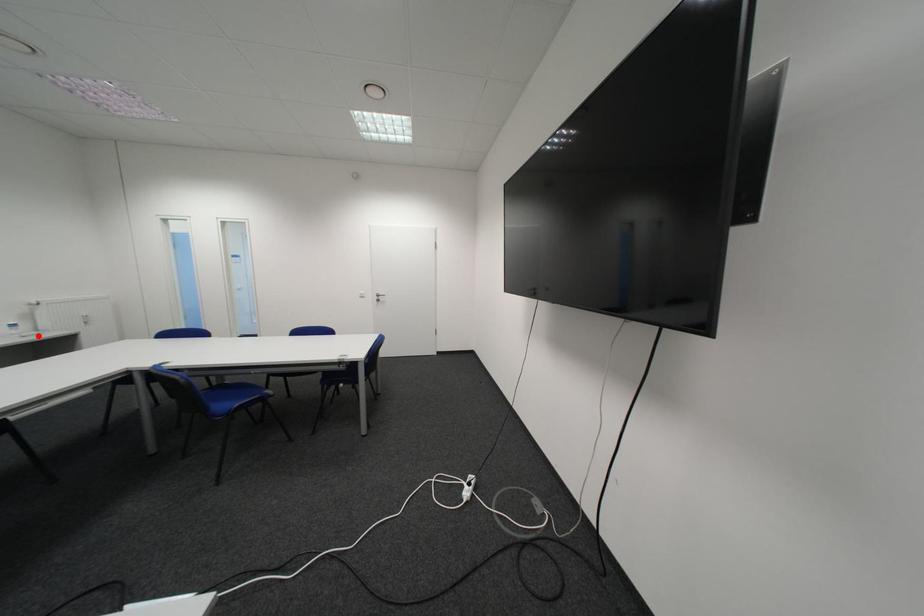
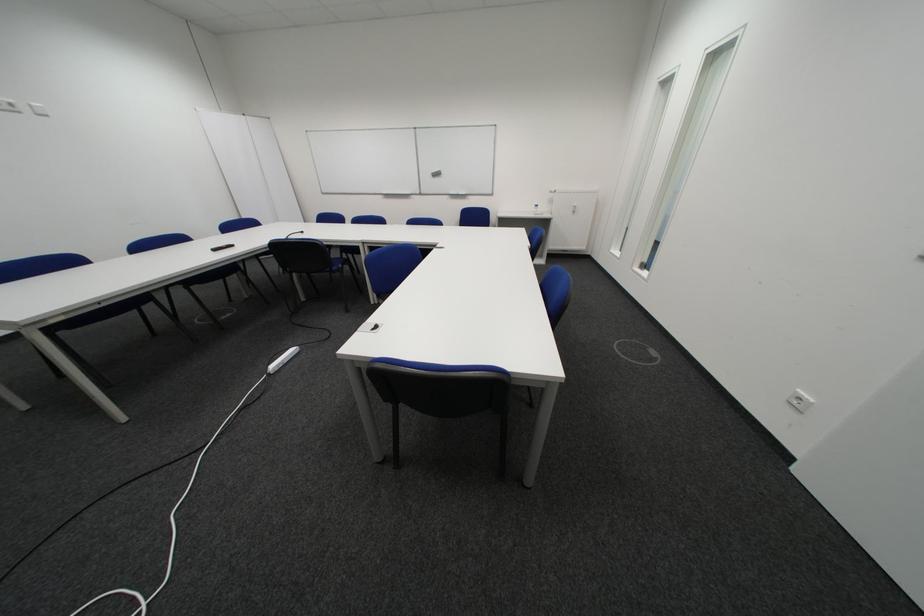
Question: A red point is marked in image1. In image2, is the corresponding 3D point closer to the camera or farther? Reply with the corresponding letter.

Choices:
 (A) The corresponding 3D point is closer.
 (B) The corresponding 3D point is farther.

Answer: (A)